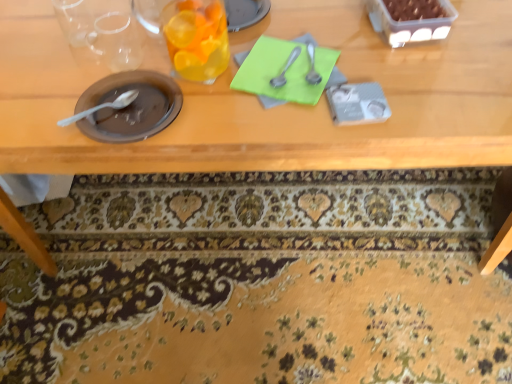
Where is `vacant space to the right of matte brown plate at left, the fourth tableware viewed from the right`? vacant space to the right of matte brown plate at left, the fourth tableware viewed from the right is located at coordinates (211, 107).